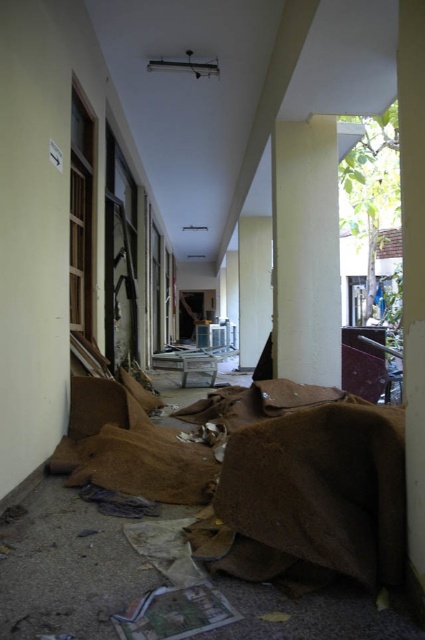
Describe the element at coordinates (306, 252) in the screenshot. I see `smooth concrete pillar at center` at that location.

Can you confirm if smooth concrete pillar at center is shorter than smooth concrete pillar at right?

In fact, smooth concrete pillar at center may be taller than smooth concrete pillar at right.

Does point (306, 160) lie behind point (422, 560)?

Yes, it is.

Where is `smooth concrete pillar at center`? The image size is (425, 640). smooth concrete pillar at center is located at coordinates (306, 252).